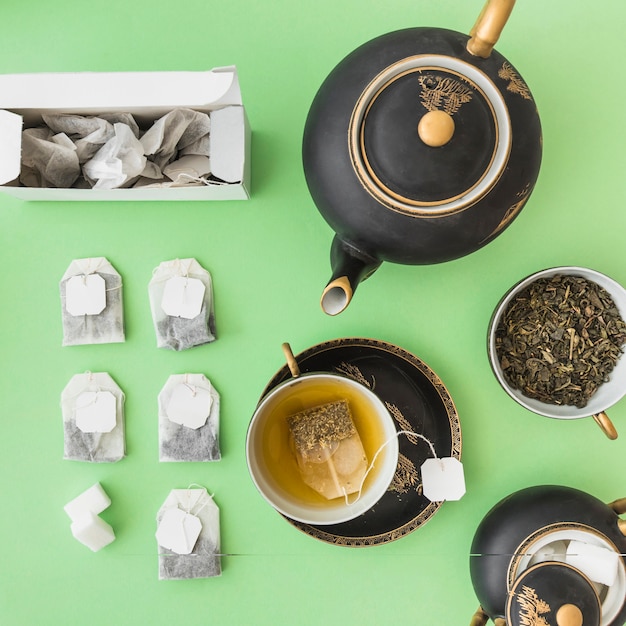
The image size is (626, 626). What are the coordinates of `box` in the screenshot? It's located at (186, 95).